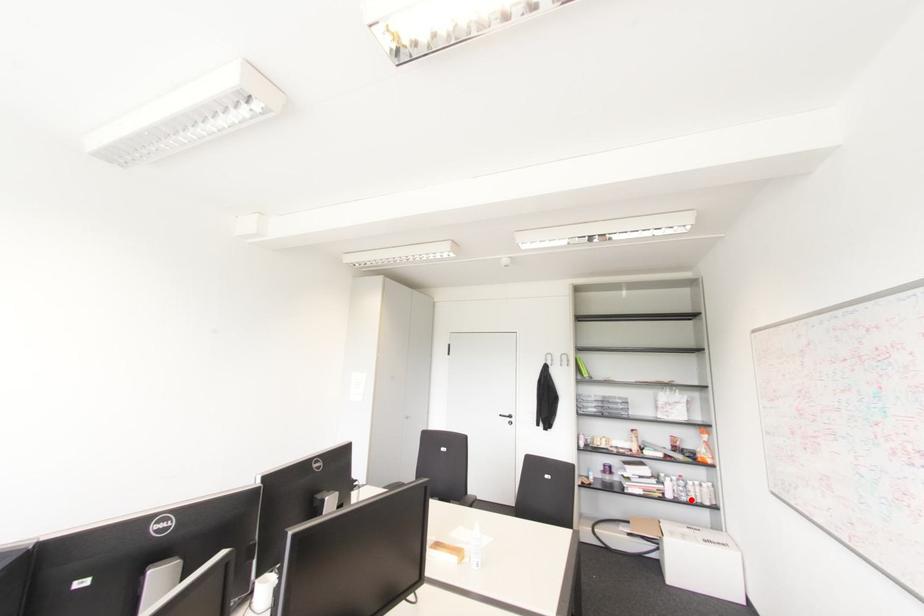
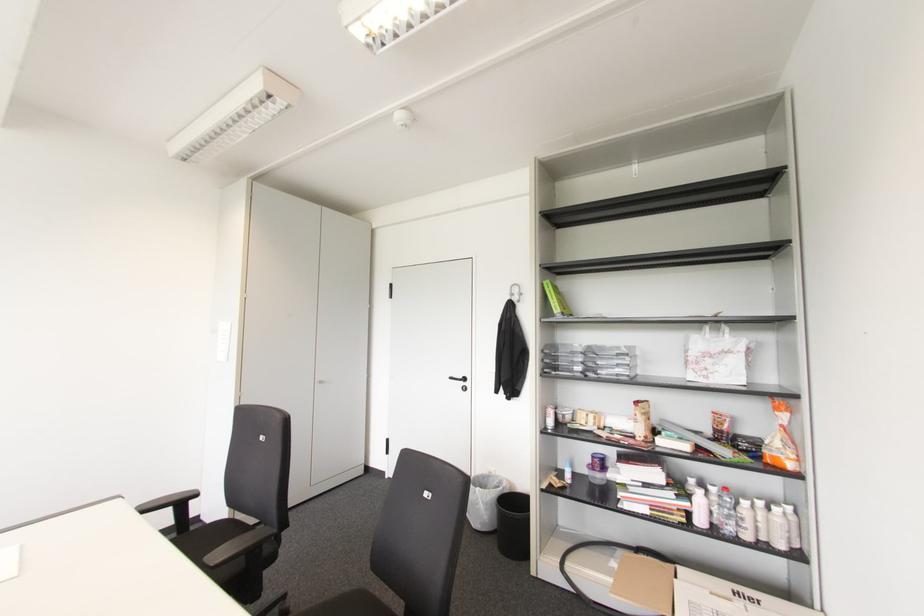
Question: I am providing you with two images of the same scene from different viewpoints. A red point is shown in image1. For the corresponding object point in image2, is it positioned nearer or farther from the camera?

Choices:
 (A) Nearer
 (B) Farther

Answer: (A)